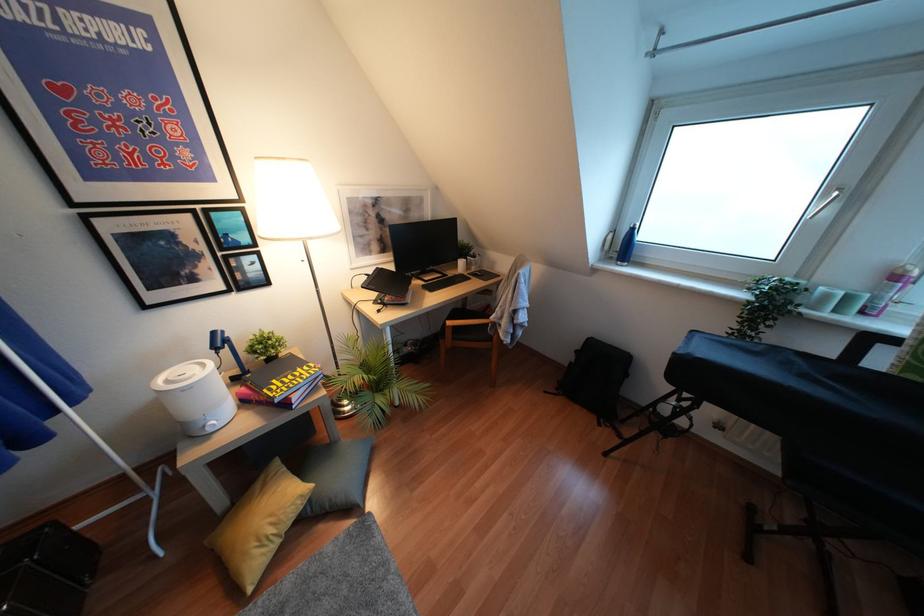
Find where to lift the blue water bottle. Please return your answer as a coordinate pair (x, y).

(626, 246)